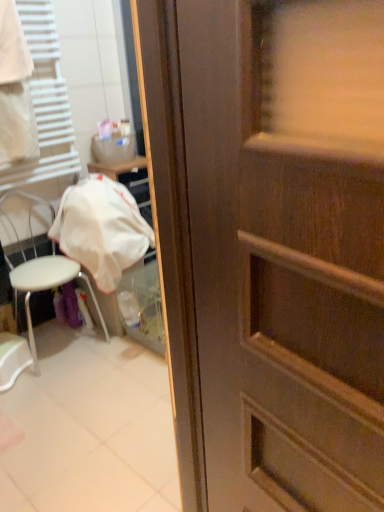
Locate an element on the screen. white fabric at left is located at coordinates (101, 229).

Is white fabric at left oriented towards white plastic chair at left?

No, white fabric at left is not facing towards white plastic chair at left.

Is white plastic chair at left completely or partially inside white fabric at left?

No, white plastic chair at left is not inside white fabric at left.

Looking at this image, from a real-world perspective, is white fabric at left physically above white plastic chair at left?

Yes, from a real-world perspective, white fabric at left is over white plastic chair at left

Can you tell me how much white fabric at left and white plastic chair at left differ in facing direction?

There is a 1.03-degree angle between the facing directions of white fabric at left and white plastic chair at left.

Who is smaller, white fabric at left or white plastic chair at left?

white fabric at left is smaller.

Would you say white fabric at left is to the left or to the right of white plastic chair at left in the picture?

Based on their positions, white fabric at left is located to the right of white plastic chair at left.

Find the location of a particular element. The width and height of the screenshot is (384, 512). chair in front of the white fabric at left is located at coordinates (47, 286).

Considering the sizes of objects white fabric at left and white plastic chair at left in the image provided, who is taller, white fabric at left or white plastic chair at left?

white plastic chair at left is taller.

Are white plastic chair at left and white fabric at left located far from each other?

They are positioned close to each other.

Is white plastic chair at left oriented away from white fabric at left?

white plastic chair at left is not turned away from white fabric at left.

Is white fabric at left surrounded by white plastic chair at left?

No, white fabric at left is not a part of white plastic chair at left.

Which is more to the right, white plastic chair at left or white fabric at left?

From the viewer's perspective, white plastic chair at left appears more on the right side.

In the image, is white fabric at left positioned in front of or behind white fabric at left?

Visually, white fabric at left is located behind white fabric at left.

The height and width of the screenshot is (512, 384). What are the coordinates of `shutter in front of the white fabric at left` in the screenshot? It's located at pyautogui.click(x=45, y=103).

Considering the points (79, 244) and (53, 116), which point is in front, point (79, 244) or point (53, 116)?

The point (79, 244) is closer to the camera.

Does white fabric at left have a lesser width compared to white fabric at left?

In fact, white fabric at left might be wider than white fabric at left.

From a real-world perspective, is white fabric at left over white fabric at left?

Yes.

Where is `shutter located above the white fabric at left (from a real-world perspective)`? shutter located above the white fabric at left (from a real-world perspective) is located at coordinates (45, 103).

From the image's perspective, is white fabric at left above or below white fabric at left?

white fabric at left is situated higher than white fabric at left in the image.

Looking at this image, is white fabric at left aimed at white fabric at left?

No, white fabric at left is not aimed at white fabric at left.

Who is taller, white plastic chair at left or white fabric at left?

Standing taller between the two is white plastic chair at left.

From a real-world perspective, who is located lower, white plastic chair at left or white fabric at left?

white plastic chair at left.

Is point (102, 315) less distant than point (101, 177)?

Yes, point (102, 315) is closer to viewer.

The height and width of the screenshot is (512, 384). Identify the location of shutter to the left of white plastic chair at left. (45, 103).

The image size is (384, 512). Identify the location of chair in front of the white fabric at left. (47, 286).

From the image, which object appears to be farther from white plastic chair at left, white fabric at left or white fabric at left?

white fabric at left is positioned further to the anchor white plastic chair at left.

Considering their positions, is white fabric at left positioned closer to white fabric at left than white plastic chair at left?

The object closer to white fabric at left is white fabric at left.

Based on their spatial positions, is white fabric at left or white fabric at left further from white plastic chair at left?

white fabric at left is further to white plastic chair at left.

When comparing their distances from white fabric at left, does white plastic chair at left or white fabric at left seem closer?

white fabric at left is closer to white fabric at left.

From the image, which object appears to be farther from white fabric at left, white fabric at left or white plastic chair at left?

Based on the image, white fabric at left appears to be further to white fabric at left.

When comparing their distances from white fabric at left, does white plastic chair at left or white fabric at left seem further?

Among the two, white fabric at left is located further to white fabric at left.

You are a GUI agent. You are given a task and a screenshot of the screen. Output one action in this format:
    pyautogui.click(x=<x>, y=<y>)
    Task: Click on the blanket between white fabric at left and white plastic chair at left vertically
    The image size is (384, 512).
    Given the screenshot: What is the action you would take?
    pyautogui.click(x=101, y=229)